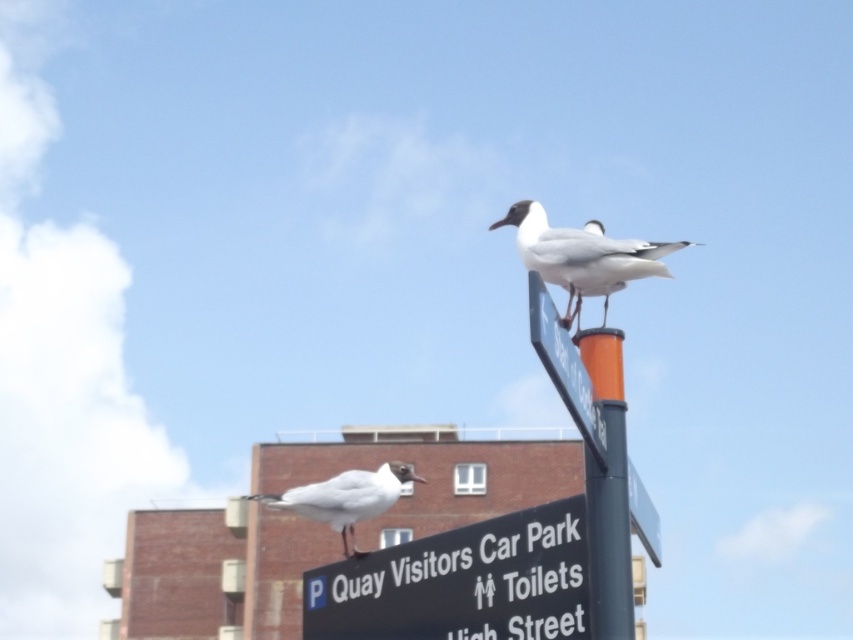
Question: Which object is closer to the camera taking this photo?

Choices:
 (A) orange matte post at upper center
 (B) metallic blue signpost at upper center
 (C) white matte bird at center

Answer: (B)

Question: Which object is farther from the camera taking this photo?

Choices:
 (A) white matte bird at upper center
 (B) metallic blue signpost at upper center
 (C) orange matte post at upper center

Answer: (C)

Question: Can you confirm if white matte bird at upper center is smaller than white matte bird at center?

Choices:
 (A) yes
 (B) no

Answer: (A)

Question: Among these objects, which one is nearest to the camera?

Choices:
 (A) orange matte post at upper center
 (B) black plastic sign at lower center
 (C) white matte bird at upper center
 (D) white matte bird at center

Answer: (C)

Question: Is black plastic sign at lower center above orange matte post at upper center?

Choices:
 (A) no
 (B) yes

Answer: (A)

Question: Is orange matte post at upper center wider than metallic blue signpost at upper center?

Choices:
 (A) no
 (B) yes

Answer: (A)